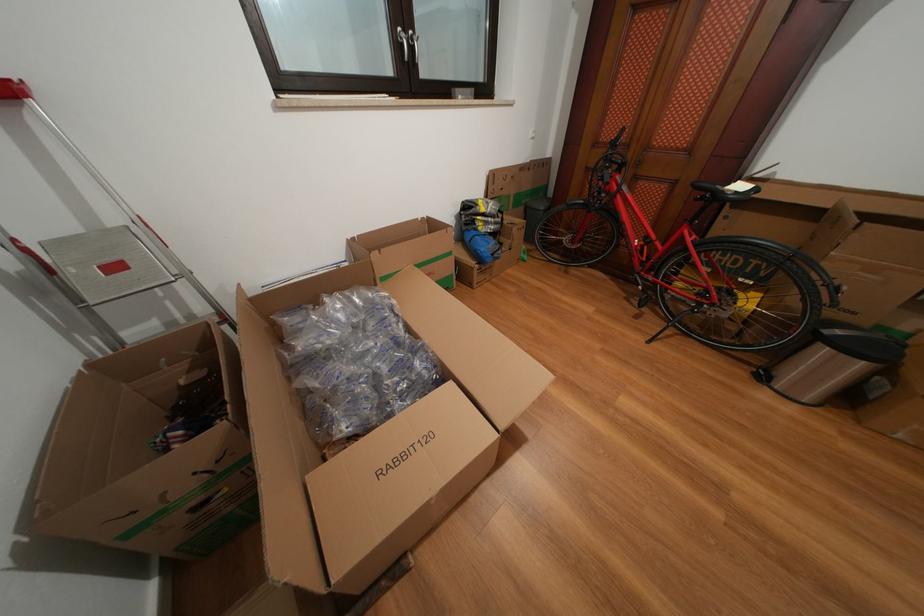
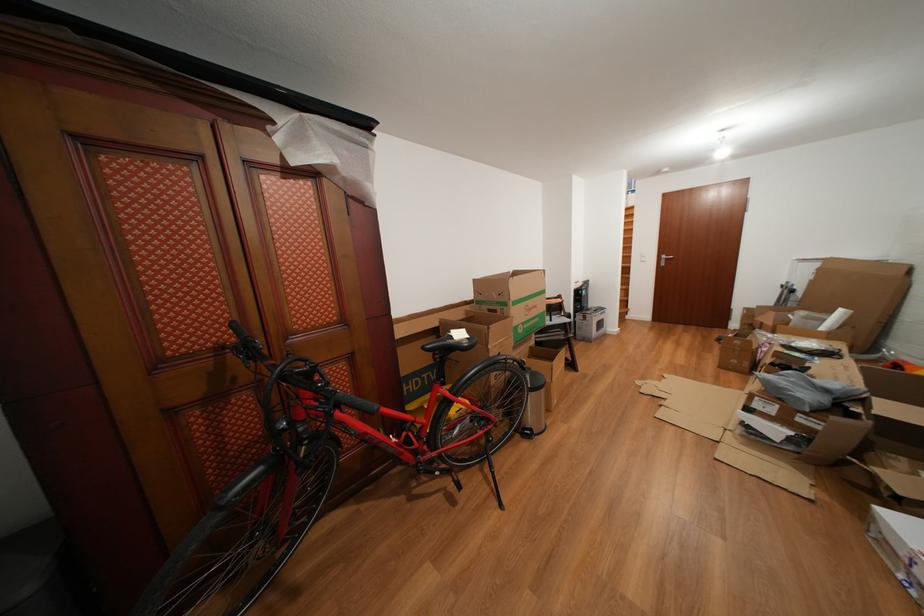
The point at (631, 135) is marked in the first image. Where is the corresponding point in the second image?

(241, 330)